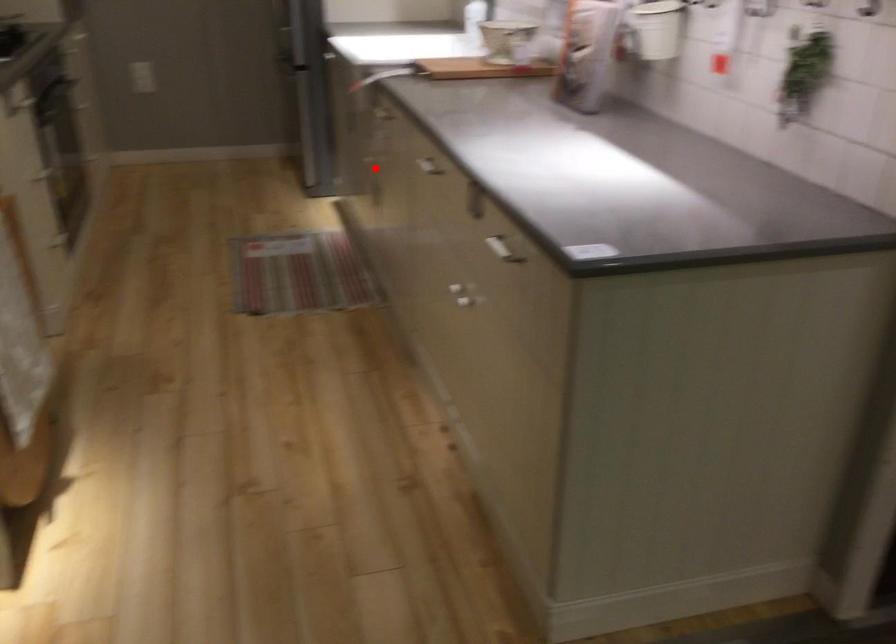
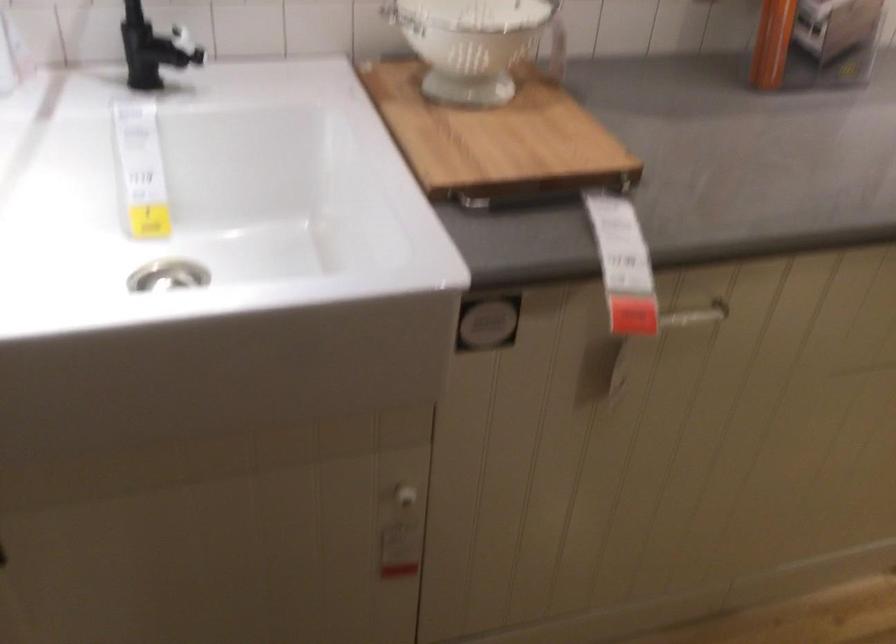
In the second image, find the point that corresponds to the highlighted location in the first image.

(403, 497)